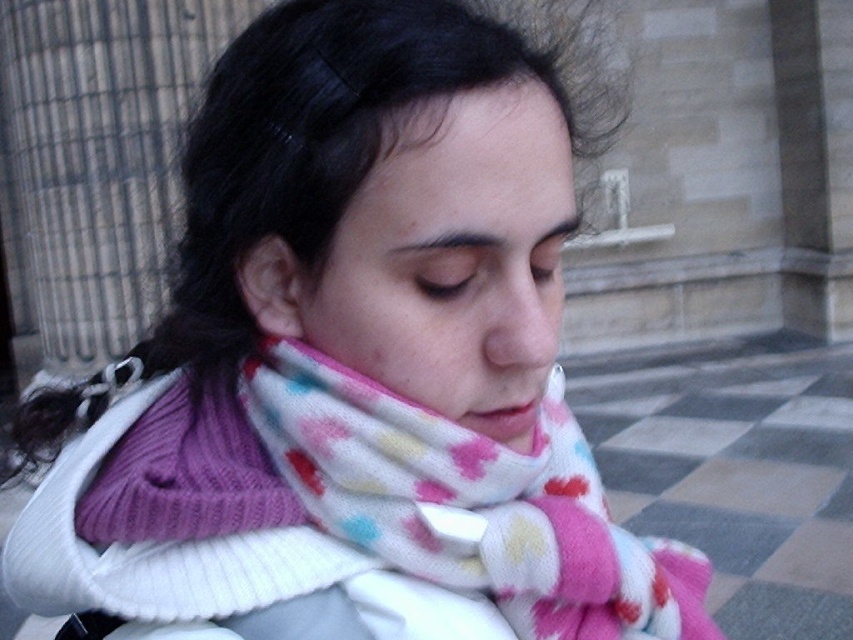
Question: Which point is closer to the camera?

Choices:
 (A) (520, 301)
 (B) (372, 394)

Answer: (A)

Question: Can you confirm if fluffy multicolored scarf at center is positioned to the right of matte pink scarf at center?

Choices:
 (A) yes
 (B) no

Answer: (A)

Question: Does fluffy multicolored scarf at center lie behind matte pink scarf at center?

Choices:
 (A) yes
 (B) no

Answer: (A)

Question: Is fluffy multicolored scarf at center thinner than matte pink scarf at center?

Choices:
 (A) yes
 (B) no

Answer: (B)